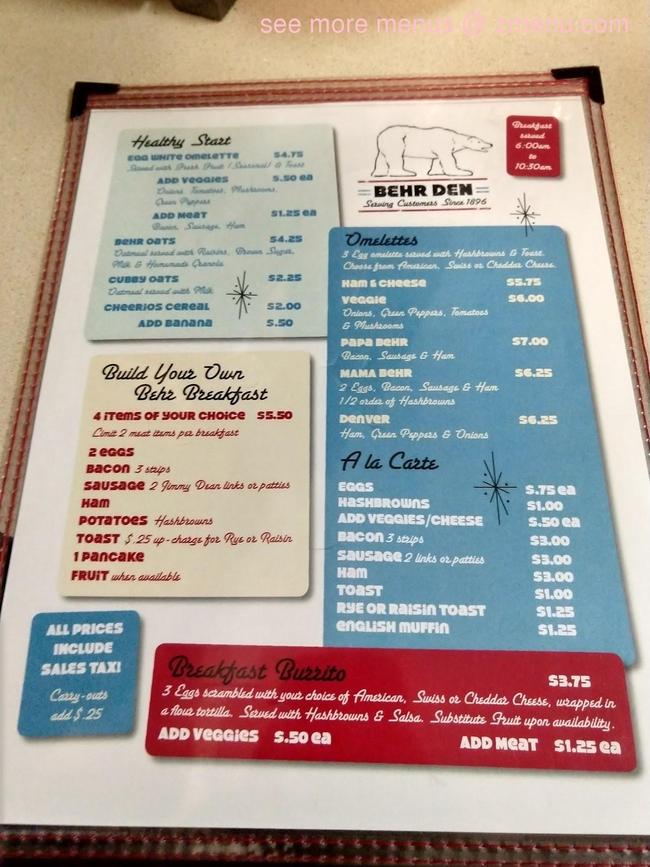
Identify the location of table. (84, 27).